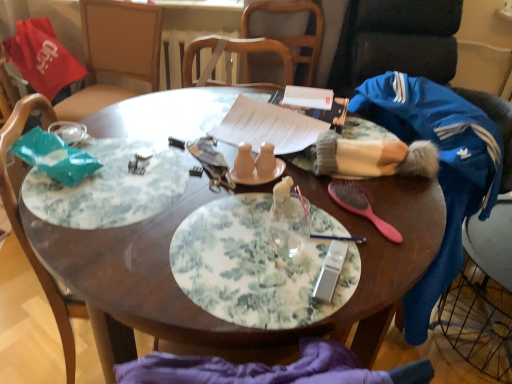
Find the location of a particular element. free space that is in between metallic silver pen at center, which appears as the fourth tableware when viewed from the left, and matte ceramic salt and pepper shakers at center, which is the first tableware in left-to-right order is located at coordinates tap(298, 215).